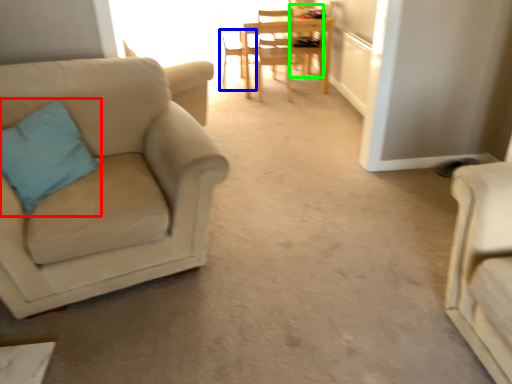
Question: Based on their relative distances, which object is farther from pillow (highlighted by a red box)? Choose from chair (highlighted by a blue box) and chair (highlighted by a green box).

Choices:
 (A) chair
 (B) chair

Answer: (B)